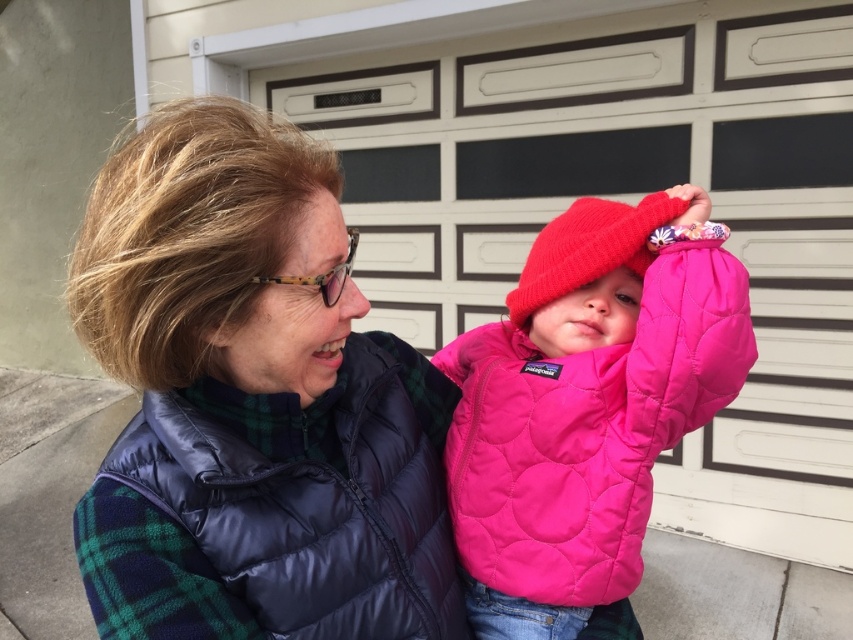
Question: From the image, what is the correct spatial relationship of pink quilted jacket at center in relation to knitted woolen hat at center?

Choices:
 (A) left
 (B) right

Answer: (A)

Question: Can you confirm if pink quilted jacket at center is bigger than navy blue puffer jacket at center?

Choices:
 (A) yes
 (B) no

Answer: (A)

Question: Which point is farther to the camera?

Choices:
 (A) (641, 504)
 (B) (540, 234)
 (C) (200, 449)

Answer: (B)

Question: Which object is the closest to the navy blue puffer jacket at center?

Choices:
 (A) knitted woolen hat at center
 (B) pink quilted jacket at center

Answer: (B)

Question: Among these objects, which one is nearest to the camera?

Choices:
 (A) navy blue puffer jacket at center
 (B) pink quilted jacket at center
 (C) knitted woolen hat at center

Answer: (A)

Question: Does navy blue puffer jacket at center have a lesser width compared to knitted woolen hat at center?

Choices:
 (A) no
 (B) yes

Answer: (A)